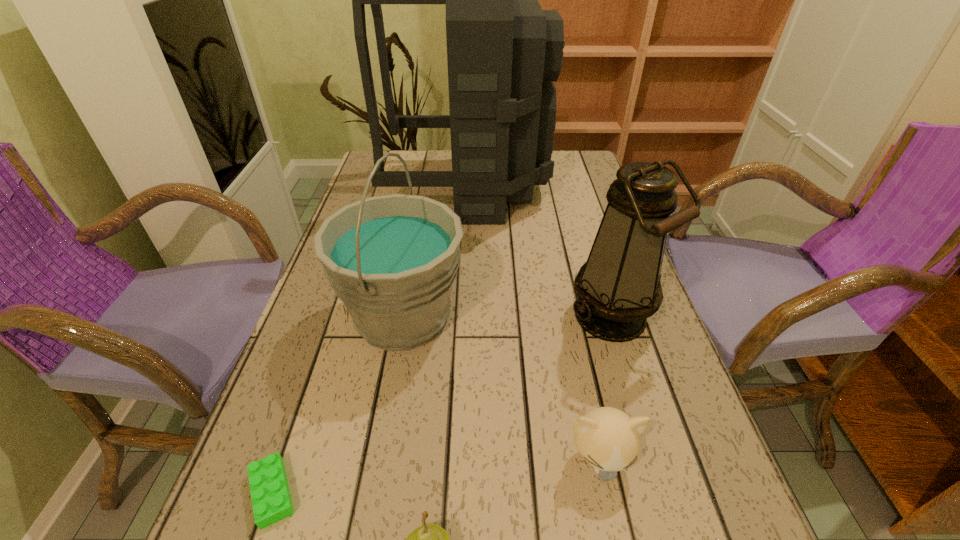
Find the location of a particular element. vacant area situated 0.200m on the back of the shortest object is located at coordinates (319, 360).

Locate an element on the screen. This screenshot has width=960, height=540. object that is at the far edge is located at coordinates click(503, 51).

The width and height of the screenshot is (960, 540). Identify the location of backpack located in the left edge section of the desktop. (503, 51).

The width and height of the screenshot is (960, 540). In order to click on bucket present at the left edge in this screenshot , I will do `click(392, 260)`.

Identify the location of Lego positioned at the left edge. This screenshot has width=960, height=540. (271, 500).

The height and width of the screenshot is (540, 960). Identify the location of oil lamp present at the right edge. (618, 288).

This screenshot has width=960, height=540. What are the coordinates of `kitten that is at the right edge` in the screenshot? It's located at (608, 439).

At what (x,y) coordinates should I click in order to perform the action: click on object situated at the far left corner. Please return your answer as a coordinate pair (x, y). Looking at the image, I should click on (503, 51).

This screenshot has width=960, height=540. I want to click on free location at the left edge of the desktop, so click(x=292, y=455).

I want to click on free space at the right edge, so click(x=620, y=489).